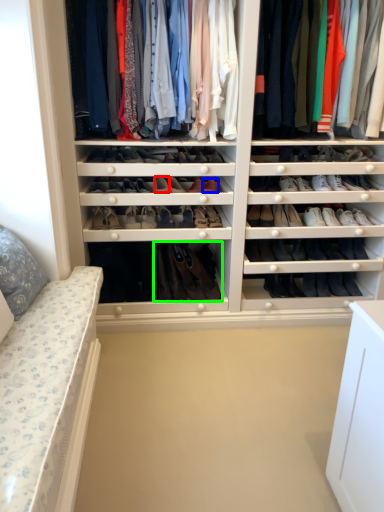
Question: Which object is positioned closest to shoe (highlighted by a red box)? Select from shoe (highlighted by a blue box) and footwear (highlighted by a green box).

Choices:
 (A) shoe
 (B) footwear

Answer: (A)